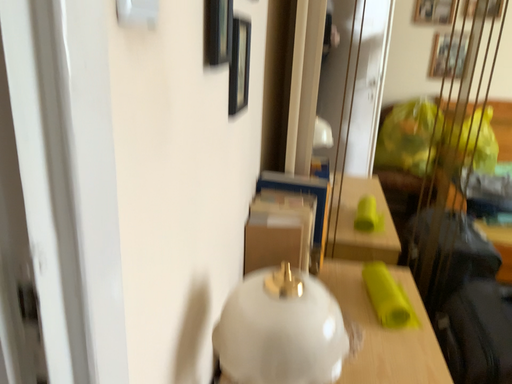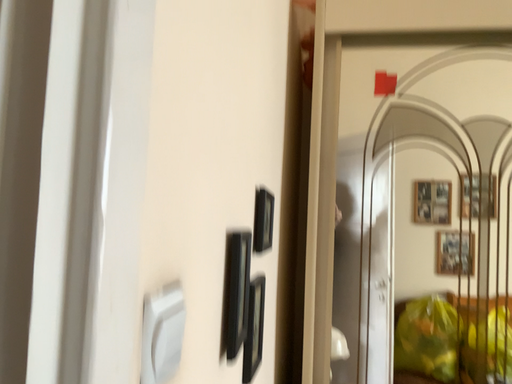
Question: How did the camera likely rotate when shooting the video?

Choices:
 (A) rotated upward
 (B) rotated downward

Answer: (A)